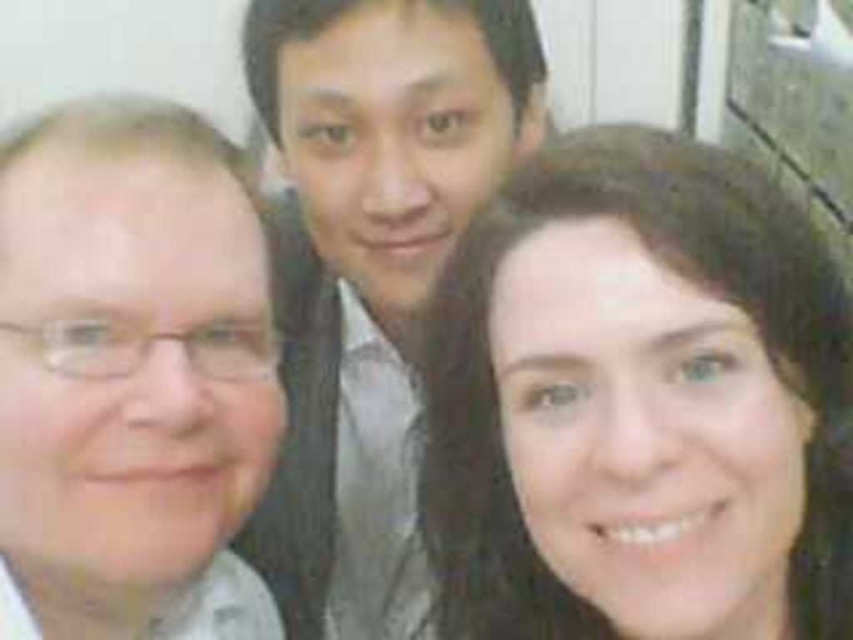
Question: Does smooth brown hair at center appear over matte gray shirt at center?

Choices:
 (A) yes
 (B) no

Answer: (B)

Question: Can you confirm if smooth brown hair at center is bigger than matte gray shirt at center?

Choices:
 (A) yes
 (B) no

Answer: (B)

Question: Which object appears closest to the camera in this image?

Choices:
 (A) smooth brown hair at center
 (B) matte gray shirt at center

Answer: (A)

Question: Can you confirm if smooth brown hair at center is smaller than matte gray shirt at center?

Choices:
 (A) no
 (B) yes

Answer: (B)

Question: Which point is farther to the camera?

Choices:
 (A) (273, 99)
 (B) (845, 483)

Answer: (A)